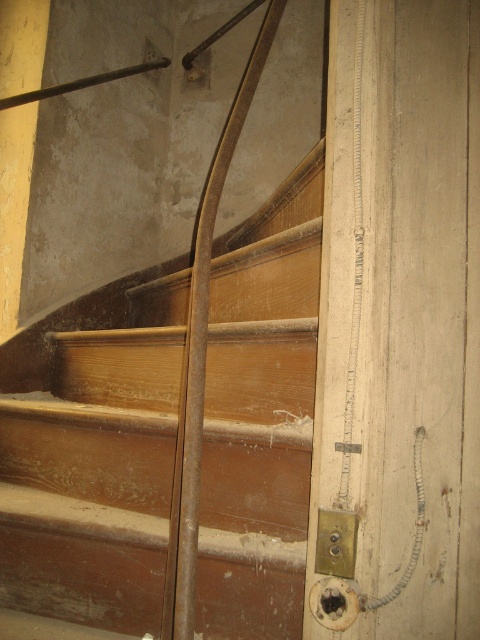
Question: Which object is closer to the camera taking this photo?

Choices:
 (A) brown wooden stairs at center
 (B) gold metallic lock at lower right

Answer: (B)

Question: Does brown wooden stairs at center have a lesser width compared to gold metallic lock at lower right?

Choices:
 (A) yes
 (B) no

Answer: (B)

Question: Does brown wooden stairs at center have a lesser width compared to gold metallic lock at lower right?

Choices:
 (A) no
 (B) yes

Answer: (A)

Question: Which point appears farthest from the camera in this image?

Choices:
 (A) (120, 429)
 (B) (327, 518)

Answer: (A)

Question: Where is brown wooden stairs at center located in relation to gold metallic lock at lower right in the image?

Choices:
 (A) left
 (B) right

Answer: (A)